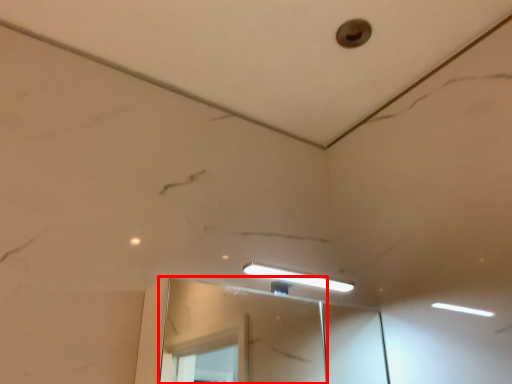
Question: From the image's perspective, considering the relative positions of mirror (annotated by the red box) and hole in the image provided, where is mirror (annotated by the red box) located with respect to the staircase?

Choices:
 (A) above
 (B) below

Answer: (B)